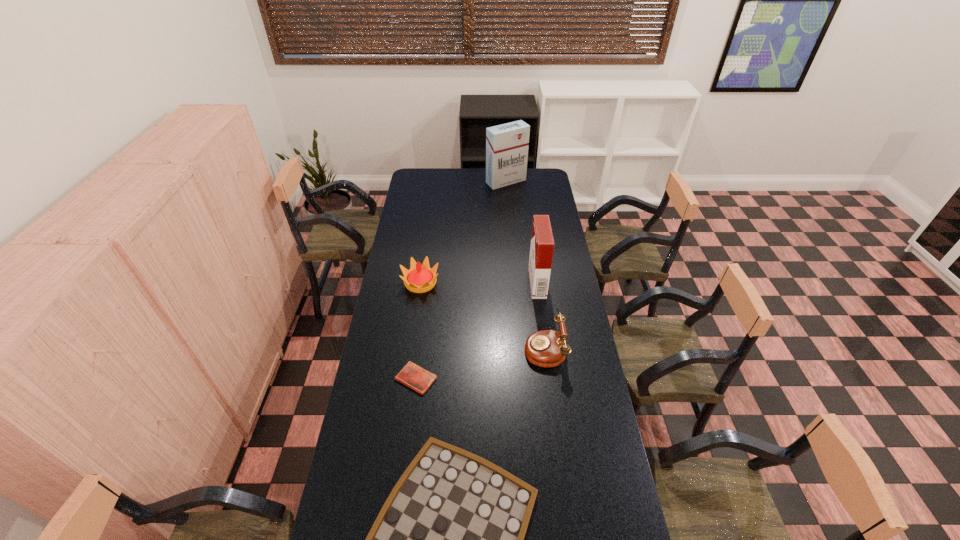
Identify which object is located as the fourth nearest to the telephone. Please provide its 2D coordinates. Your answer should be formatted as a tuple, i.e. [(x, y)], where the tuple contains the x and y coordinates of a point satisfying the conditions above.

[(419, 278)]

This screenshot has width=960, height=540. I want to click on vacant space that satisfies the following two spatial constraints: 1. on the dial of the telephone; 2. on the front side of the diary, so click(549, 379).